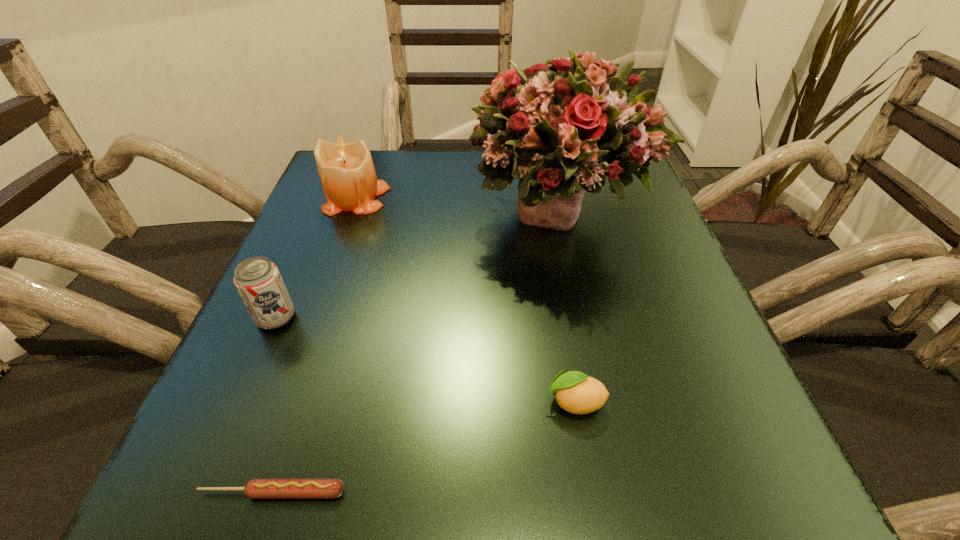
Find the location of a particular element. sausage that is positioned at the left edge is located at coordinates (256, 488).

Identify the location of object situated at the right edge. The height and width of the screenshot is (540, 960). (563, 127).

The width and height of the screenshot is (960, 540). I want to click on object located in the far left corner section of the desktop, so click(x=347, y=175).

Where is `object present at the near left corner`? The width and height of the screenshot is (960, 540). object present at the near left corner is located at coordinates (256, 488).

Locate an element on the screen. This screenshot has height=540, width=960. object located in the far right corner section of the desktop is located at coordinates (563, 127).

This screenshot has height=540, width=960. In the image, there is a desktop. What are the coordinates of `vacant space at the far edge` in the screenshot? It's located at (407, 188).

Find the location of a particular element. This screenshot has height=540, width=960. vacant space at the left edge of the desktop is located at coordinates (345, 236).

The width and height of the screenshot is (960, 540). Find the location of `vacant area at the right edge`. vacant area at the right edge is located at coordinates (657, 275).

This screenshot has width=960, height=540. In the image, there is a desktop. What are the coordinates of `vacant space at the far left corner` in the screenshot? It's located at (307, 205).

Where is `vacant space at the near left corner of the desktop`? This screenshot has width=960, height=540. vacant space at the near left corner of the desktop is located at coordinates (308, 456).